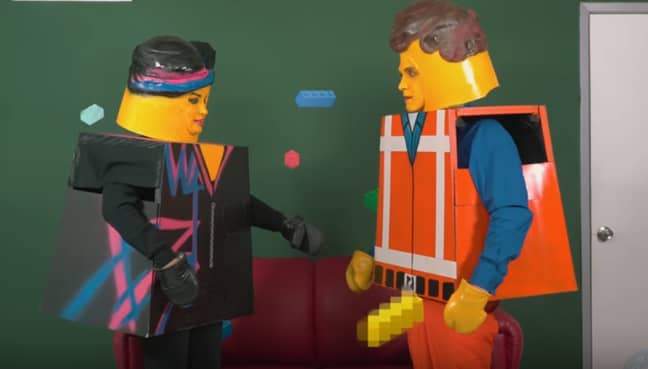
This screenshot has height=369, width=648. Identify the location of door. (628, 109).